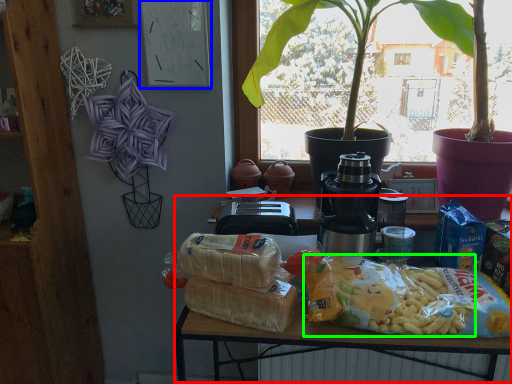
Question: Estimate the real-world distances between objects in this image. Which object is farther from table (highlighted by a red box), bulletin board (highlighted by a blue box) or food (highlighted by a green box)?

Choices:
 (A) bulletin board
 (B) food

Answer: (A)